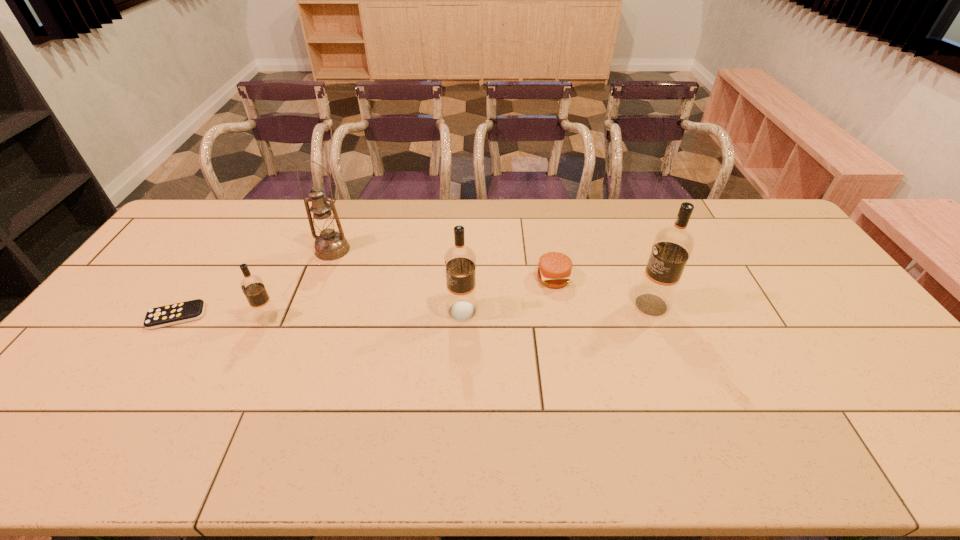
Identify the location of the shortest vodka. The height and width of the screenshot is (540, 960). (253, 288).

What are the coordinates of `the third shortest object` in the screenshot? It's located at (253, 288).

Where is `the fourth object from left to right`? This screenshot has width=960, height=540. the fourth object from left to right is located at coordinates (460, 261).

The width and height of the screenshot is (960, 540). What are the coordinates of `the second tallest vodka` in the screenshot? It's located at (460, 261).

Locate an element on the screen. the rightmost object is located at coordinates (672, 247).

The height and width of the screenshot is (540, 960). In order to click on the farthest object in this screenshot , I will do `click(330, 245)`.

What are the coordinates of `oil lamp` in the screenshot? It's located at (330, 245).

Identify the location of the fifth object from left to right. (554, 269).

Locate an element on the screen. the second farthest object is located at coordinates (554, 269).

You are a GUI agent. You are given a task and a screenshot of the screen. Output one action in this format:
    pyautogui.click(x=<x>, y=<y>)
    Task: Click on the shortest object
    
    Given the screenshot: What is the action you would take?
    pyautogui.click(x=182, y=312)